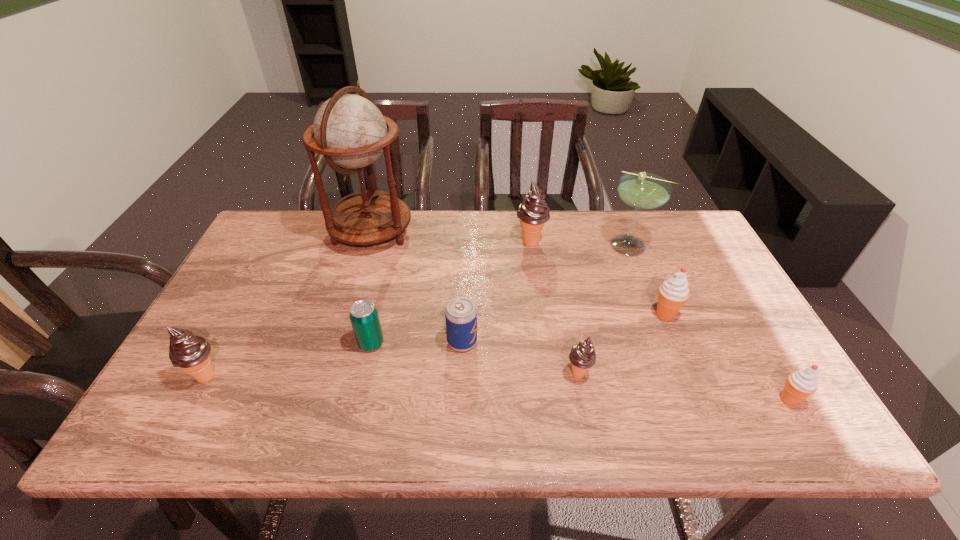
Identify the location of globe. (350, 131).

Locate an element on the screen. The width and height of the screenshot is (960, 540). martini is located at coordinates click(641, 190).

In order to click on the farthest chocolate icecream in this screenshot , I will do point(533,212).

Identify the location of the tallest icecream. The height and width of the screenshot is (540, 960). (533, 212).

This screenshot has width=960, height=540. I want to click on the leftmost object, so click(x=190, y=353).

The height and width of the screenshot is (540, 960). Find the location of `the leftmost chocolate icecream`. the leftmost chocolate icecream is located at coordinates (190, 353).

Image resolution: width=960 pixels, height=540 pixels. Identify the location of the farther red icecream. (673, 293).

At what (x,y) coordinates should I click in order to perform the action: click on the sixth nearest object. Please return your answer as a coordinate pair (x, y). The height and width of the screenshot is (540, 960). Looking at the image, I should click on (673, 293).

What are the coordinates of `the right beer can` in the screenshot? It's located at (460, 313).

You are a GUI agent. You are given a task and a screenshot of the screen. Output one action in this format:
    pyautogui.click(x=<x>, y=<y>)
    Task: Click on the teal beer can
    The image size is (960, 540).
    Given the screenshot: What is the action you would take?
    pyautogui.click(x=363, y=315)